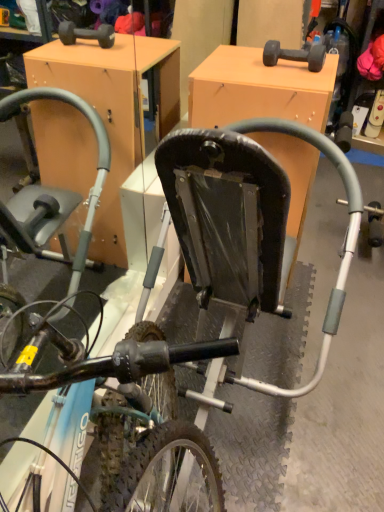
Question: Should I look upward or downward to see matte orange cabinet at center?

Choices:
 (A) down
 (B) up

Answer: (B)

Question: Can you confirm if metallic silver bicycle at center is thinner than matte orange cabinet at center?

Choices:
 (A) yes
 (B) no

Answer: (A)

Question: Is metallic silver bicycle at center positioned in front of matte orange cabinet at center?

Choices:
 (A) no
 (B) yes

Answer: (B)

Question: Is metallic silver bicycle at center facing away from matte orange cabinet at center?

Choices:
 (A) no
 (B) yes

Answer: (B)

Question: From a real-world perspective, is metallic silver bicycle at center positioned under matte orange cabinet at center based on gravity?

Choices:
 (A) yes
 (B) no

Answer: (B)

Question: From a real-world perspective, is metallic silver bicycle at center positioned over matte orange cabinet at center based on gravity?

Choices:
 (A) no
 (B) yes

Answer: (B)

Question: Is metallic silver bicycle at center surrounding matte orange cabinet at center?

Choices:
 (A) yes
 (B) no

Answer: (B)

Question: Would you say matte orange cabinet at center is outside metallic silver bicycle at center?

Choices:
 (A) no
 (B) yes

Answer: (B)

Question: Can you confirm if matte orange cabinet at center is bigger than metallic silver bicycle at center?

Choices:
 (A) no
 (B) yes

Answer: (B)

Question: Does matte orange cabinet at center have a greater width compared to metallic silver bicycle at center?

Choices:
 (A) no
 (B) yes

Answer: (B)

Question: Is matte orange cabinet at center far away from metallic silver bicycle at center?

Choices:
 (A) yes
 (B) no

Answer: (B)

Question: From the image's perspective, is matte orange cabinet at center on metallic silver bicycle at center?

Choices:
 (A) yes
 (B) no

Answer: (B)

Question: Is metallic silver bicycle at center completely or partially inside matte orange cabinet at center?

Choices:
 (A) yes
 (B) no

Answer: (B)

Question: Would you say matte orange cabinet at center is inside or outside metallic silver bicycle at center?

Choices:
 (A) inside
 (B) outside

Answer: (B)